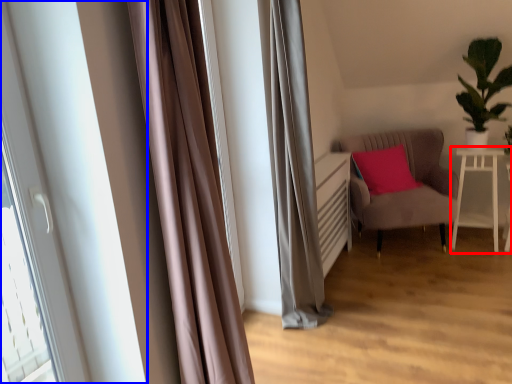
Question: Among these objects, which one is nearest to the camera, table (highlighted by a red box) or bay window (highlighted by a blue box)?

Choices:
 (A) table
 (B) bay window

Answer: (B)